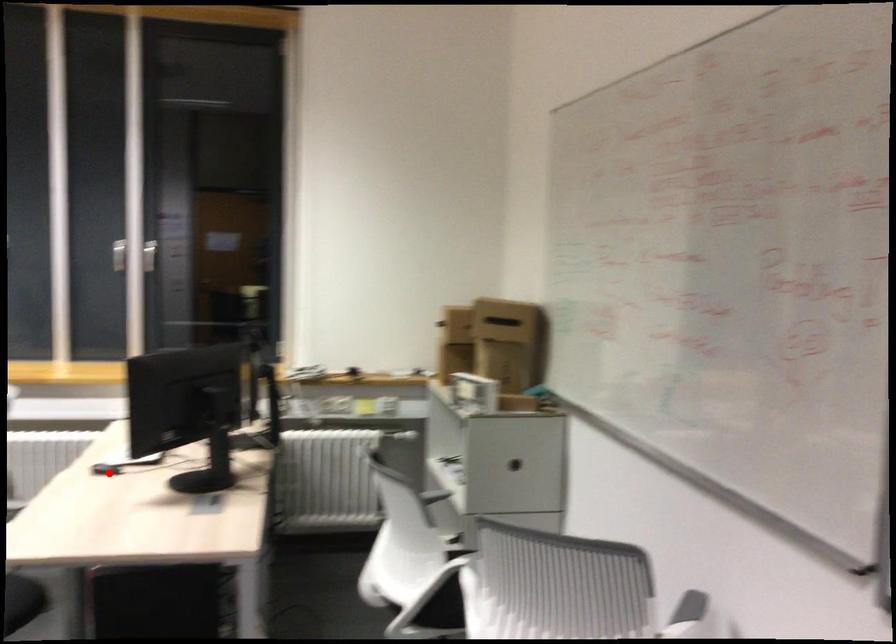
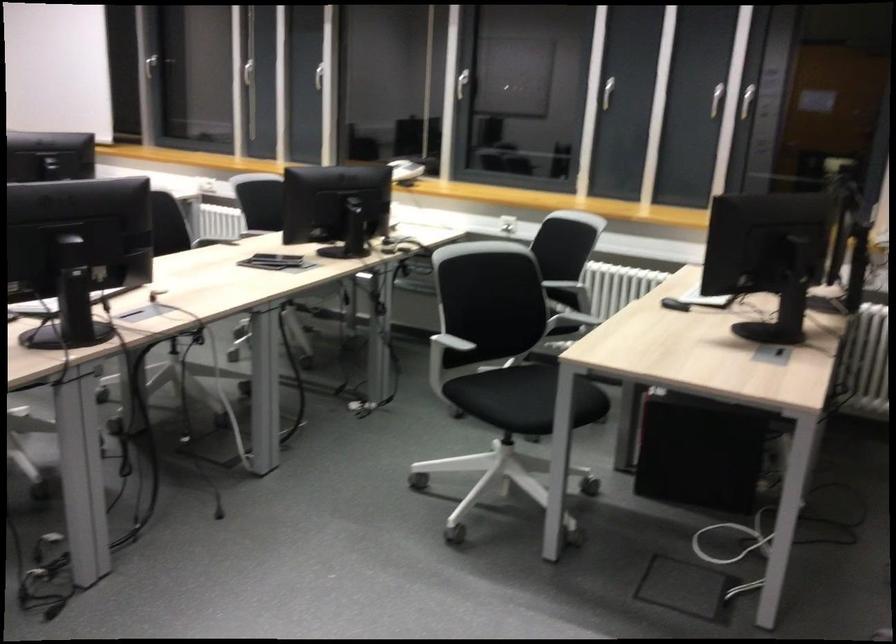
Find the pixel in the second image that matches the highlighted location in the first image.

(675, 304)